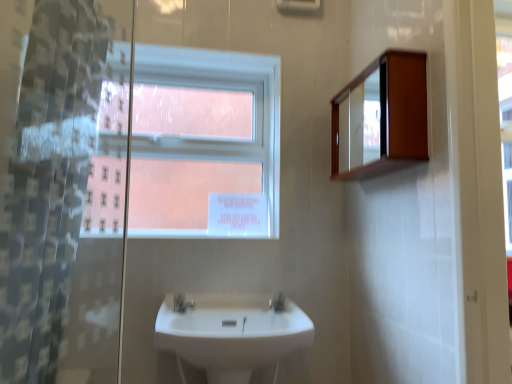
Question: Is silver metallic tap at center, the second tap viewed from the right, to the right of white glossy sink at center from the viewer's perspective?

Choices:
 (A) yes
 (B) no

Answer: (B)

Question: Is silver metallic tap at center, the second tap viewed from the right, beside white glossy sink at center?

Choices:
 (A) no
 (B) yes

Answer: (A)

Question: Is silver metallic tap at center, which is counted as the first tap, starting from the left, facing away from white glossy sink at center?

Choices:
 (A) yes
 (B) no

Answer: (A)

Question: Would you say silver metallic tap at center, which is counted as the first tap, starting from the left, contains white glossy sink at center?

Choices:
 (A) yes
 (B) no

Answer: (B)

Question: From a real-world perspective, is silver metallic tap at center, the second tap viewed from the right, over white glossy sink at center?

Choices:
 (A) no
 (B) yes

Answer: (B)

Question: Looking at their shapes, would you say white glossy tap at center, the 2th tap in the left-to-right sequence, is wider or thinner than wooden medicine cabinet at upper right?

Choices:
 (A) wide
 (B) thin

Answer: (B)

Question: Is point (269, 301) closer or farther from the camera than point (409, 97)?

Choices:
 (A) farther
 (B) closer

Answer: (A)

Question: Looking at the image, does white glossy tap at center, the 2th tap in the left-to-right sequence, seem bigger or smaller compared to wooden medicine cabinet at upper right?

Choices:
 (A) big
 (B) small

Answer: (B)

Question: Is white glossy tap at center, the 1th tap viewed from the right, to the left or to the right of wooden medicine cabinet at upper right in the image?

Choices:
 (A) left
 (B) right

Answer: (A)

Question: Is white glossy sink at center taller or shorter than clear plastic shower curtain at left?

Choices:
 (A) tall
 (B) short

Answer: (B)

Question: From a real-world perspective, is white glossy sink at center above or below clear plastic shower curtain at left?

Choices:
 (A) above
 (B) below

Answer: (B)

Question: Looking at the image, does white glossy sink at center seem bigger or smaller compared to clear plastic shower curtain at left?

Choices:
 (A) small
 (B) big

Answer: (B)

Question: Is point (222, 377) closer or farther from the camera than point (48, 370)?

Choices:
 (A) farther
 (B) closer

Answer: (A)

Question: Is white glossy sink at center to the left or to the right of silver metallic tap at center, the second tap viewed from the right, in the image?

Choices:
 (A) left
 (B) right

Answer: (B)

Question: From their relative heights in the image, would you say white glossy sink at center is taller or shorter than silver metallic tap at center, which is counted as the first tap, starting from the left?

Choices:
 (A) tall
 (B) short

Answer: (A)